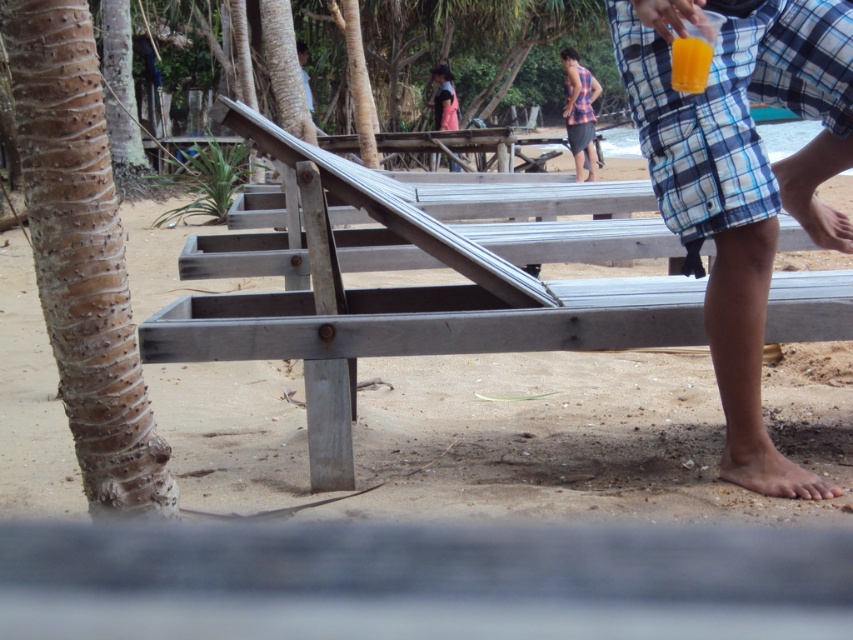
Consider the image. You are a photographer setting up a shot of the beach scene. You need to place a 12 inch ruler between the plaid fabric shirt at upper right and the translucent plastic cup at upper right. Which object should the ruler be placed closer to to ensure it fits within the frame?

The ruler should be placed closer to the translucent plastic cup at upper right because the plaid fabric shirt at upper right is wider than the translucent plastic cup at upper right, so positioning the ruler near the narrower object ensures it fits within the frame.

You are a photographer standing at the beach and want to capture both the plaid fabric shirt at upper right and the translucent plastic cup at upper right in the same photo. The camera you have has a maximum focus range of 15 meters. Will both objects be in focus?

The plaid fabric shirt at upper right is 15.33 meters away from the translucent plastic cup at upper right. Since the maximum focus range is 15 meters, the distance between them exceeds this limit, so both objects cannot be in focus simultaneously.